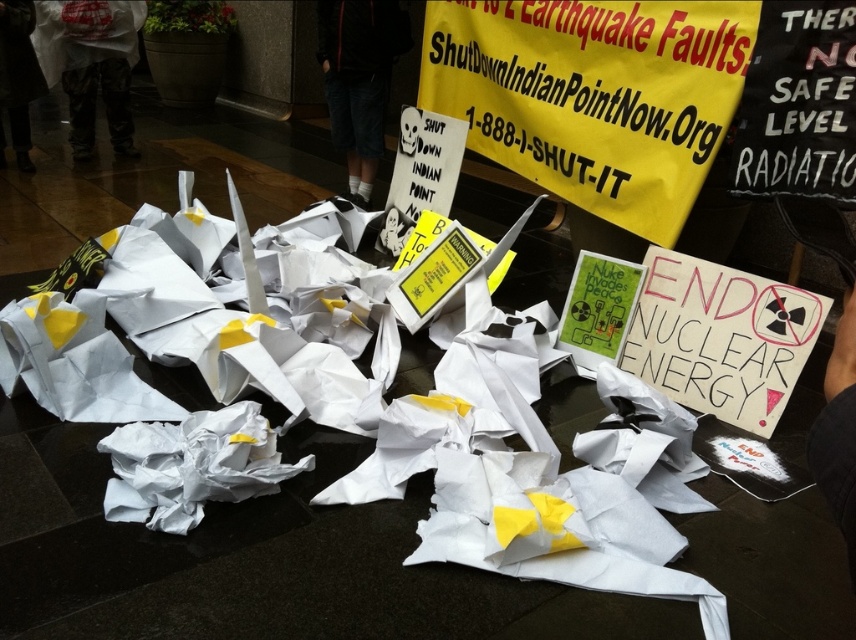
You are a protester holding a sign that needs to be placed on the ground. You have to choose between placing it on the white crumpled paper at center or the white cotton shorts at center. Which surface is larger and more stable for the sign?

The white crumpled paper at center is bigger than the white cotton shorts at center, so it is more stable and suitable for placing the sign.